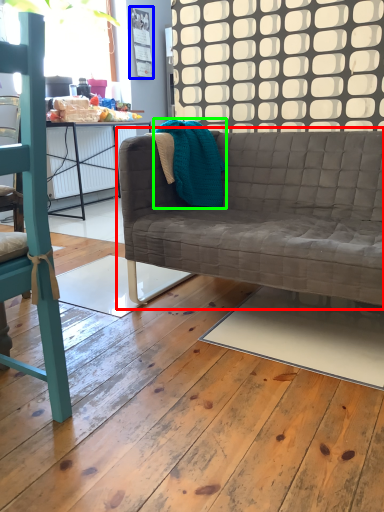
Question: Considering the real-world distances, which object is farthest from studio couch (highlighted by a red box)? bulletin board (highlighted by a blue box) or material (highlighted by a green box)?

Choices:
 (A) bulletin board
 (B) material

Answer: (A)